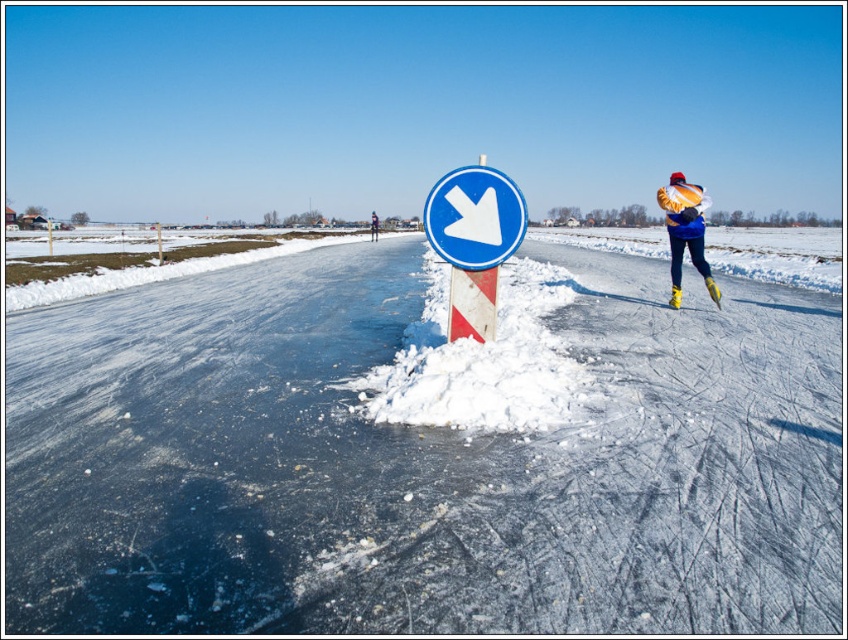
Which is more to the right, yellow synthetic skates at right or white plastic arrow at center?

Positioned to the right is yellow synthetic skates at right.

Who is taller, yellow synthetic skates at right or white plastic arrow at center?

yellow synthetic skates at right is taller.

Which is in front, point (679, 209) or point (487, 200)?

Point (487, 200) is more forward.

Locate an element on the screen. yellow synthetic skates at right is located at coordinates (685, 230).

Can you confirm if white powdery snow at center is smaller than blue plastic sign at center?

No, white powdery snow at center is not smaller than blue plastic sign at center.

Who is more forward, (143, 476) or (484, 177)?

Point (143, 476) is more forward.

Identify the location of white powdery snow at center. This screenshot has width=848, height=640. point(422,451).

Is point (477, 220) behind point (374, 228)?

No, (477, 220) is closer to viewer.

Between white plastic arrow at center and blue woolen hat at upper center, which one has more height?

blue woolen hat at upper center is taller.

What do you see at coordinates (473, 216) in the screenshot? The height and width of the screenshot is (640, 848). I see `white plastic arrow at center` at bounding box center [473, 216].

Where is `white plastic arrow at center`? The image size is (848, 640). white plastic arrow at center is located at coordinates (473, 216).